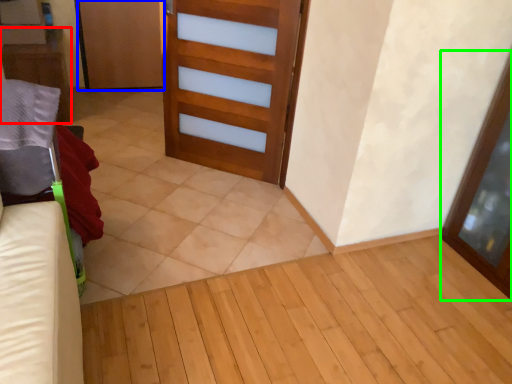
Question: Estimate the real-world distances between objects in this image. Which object is farther from furniture (highlighted by a red box), door (highlighted by a blue box) or screen door (highlighted by a green box)?

Choices:
 (A) door
 (B) screen door

Answer: (B)